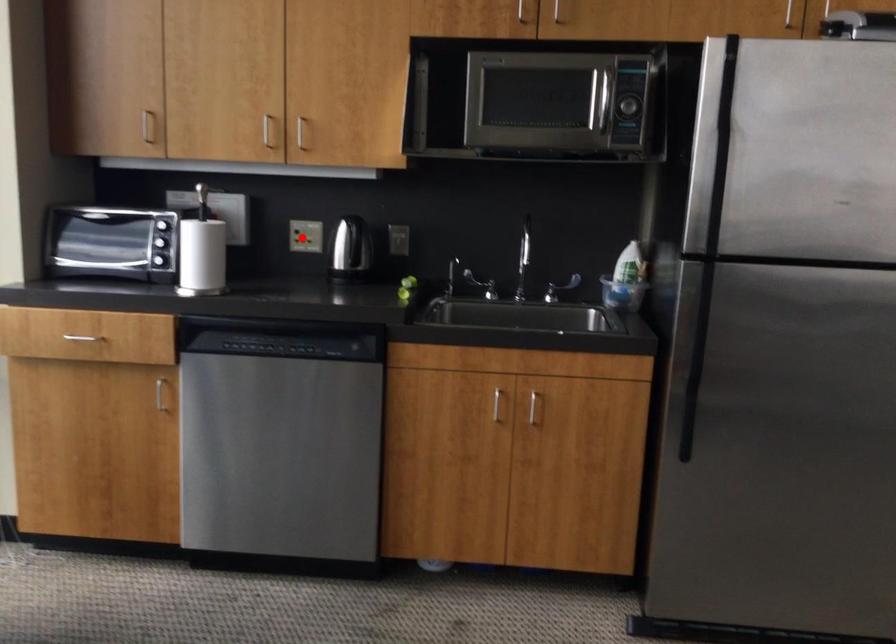
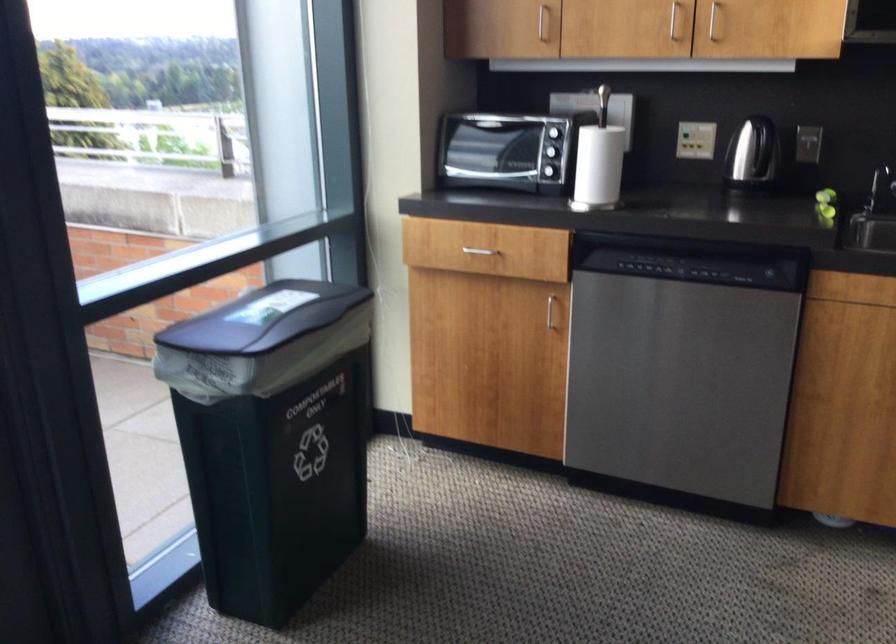
Question: I am providing you with two images of the same scene from different viewpoints. Given a red point in image1, look at the same physical point in image2. Is it:

Choices:
 (A) Closer to the viewpoint
 (B) Farther from the viewpoint

Answer: (A)